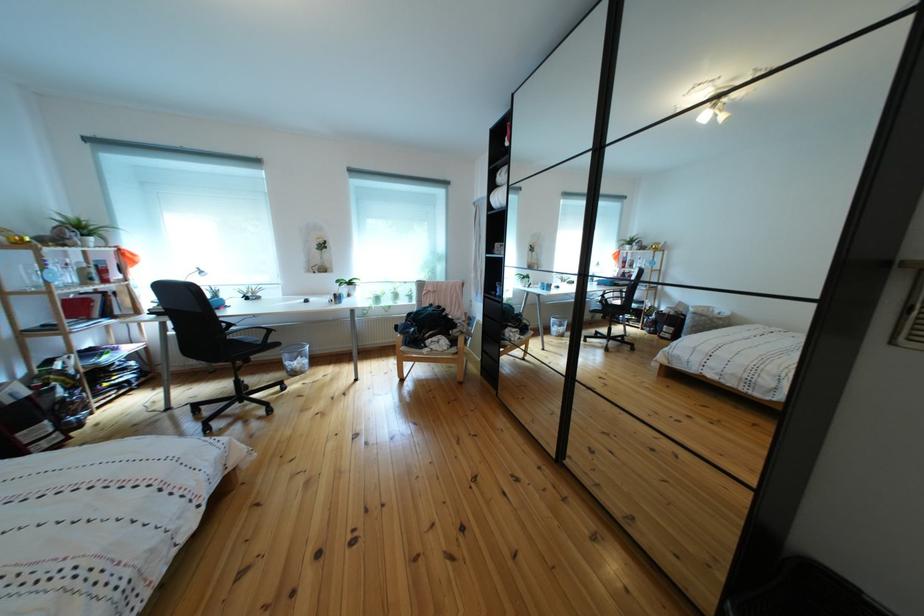
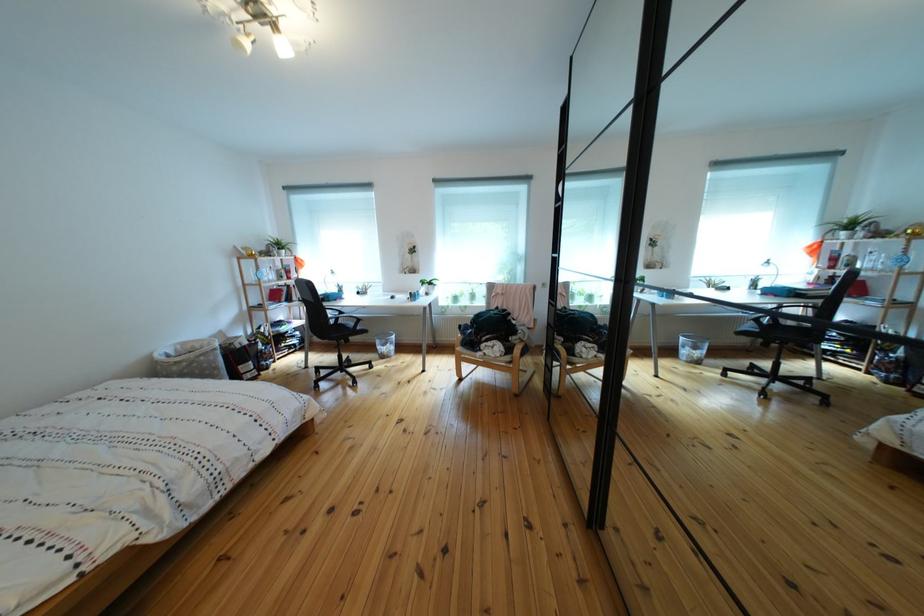
In the second image, find the point that corresponds to (x=527, y=318) in the first image.

(613, 329)